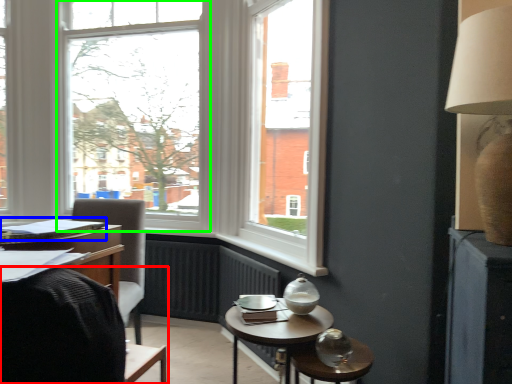
Question: Which object is positioned farthest from chair (highlighted by a red box)? Select from book (highlighted by a blue box) and window (highlighted by a green box).

Choices:
 (A) book
 (B) window

Answer: (B)